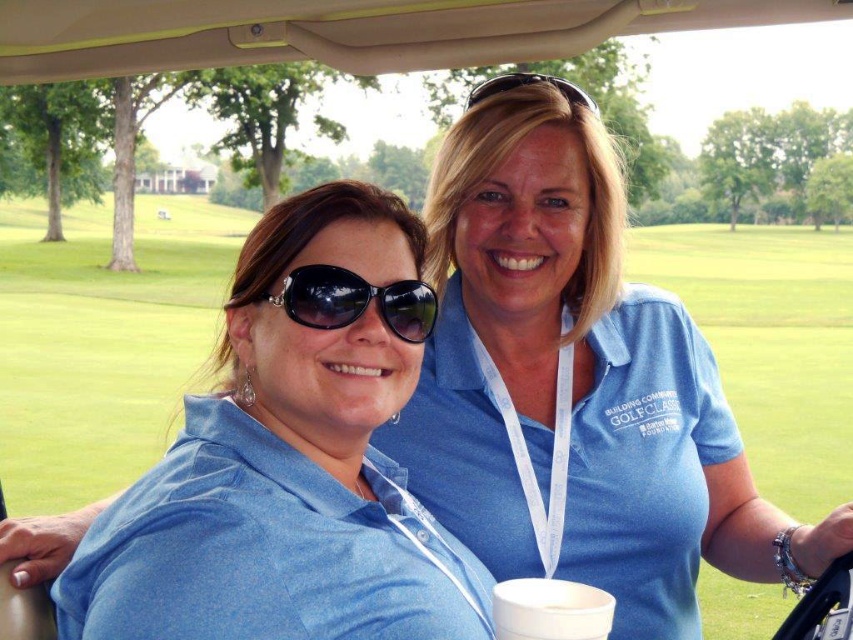
Question: Which point is closer to the camera?

Choices:
 (A) (161, 563)
 (B) (566, 83)

Answer: (A)

Question: Is black reflective sunglasses at center further to the viewer compared to white paper cup at lower center?

Choices:
 (A) yes
 (B) no

Answer: (A)

Question: Which of the following is the closest to the observer?

Choices:
 (A) (317, 627)
 (B) (553, 81)
 (C) (311, 324)

Answer: (A)

Question: In this image, where is black reflective sunglasses at center located relative to white paper cup at lower center?

Choices:
 (A) left
 (B) right

Answer: (A)

Question: Considering the real-world distances, which object is closest to the white paper cup at lower center?

Choices:
 (A) blue cotton shirt at center
 (B) black reflective sunglasses at center

Answer: (A)

Question: Can you confirm if blue cotton shirt at center is positioned to the right of black reflective sunglasses at center?

Choices:
 (A) yes
 (B) no

Answer: (A)